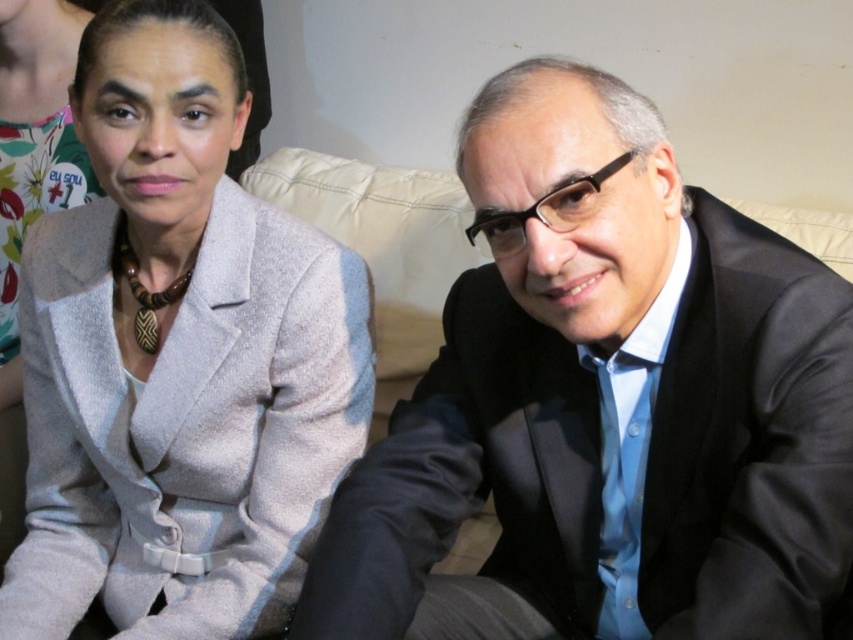
Does black glossy suit at right appear under matte gray blazer at center?

Indeed, black glossy suit at right is positioned under matte gray blazer at center.

Which of these two, black glossy suit at right or matte gray blazer at center, stands shorter?

Standing shorter between the two is black glossy suit at right.

You are a GUI agent. You are given a task and a screenshot of the screen. Output one action in this format:
    pyautogui.click(x=<x>, y=<y>)
    Task: Click on the black glossy suit at right
    
    Given the screenshot: What is the action you would take?
    pyautogui.click(x=605, y=404)

Is black glossy suit at right wider than matte gray blazer at upper left?

Correct, the width of black glossy suit at right exceeds that of matte gray blazer at upper left.

Is black glossy suit at right to the right of matte gray blazer at upper left from the viewer's perspective?

Indeed, black glossy suit at right is positioned on the right side of matte gray blazer at upper left.

Does point (700, 557) come in front of point (3, 13)?

Yes, point (700, 557) is in front of point (3, 13).

Locate an element on the screen. The width and height of the screenshot is (853, 640). black glossy suit at right is located at coordinates (605, 404).

Does matte gray blazer at center have a smaller size compared to matte gray blazer at upper left?

Incorrect, matte gray blazer at center is not smaller in size than matte gray blazer at upper left.

Is matte gray blazer at center thinner than matte gray blazer at upper left?

In fact, matte gray blazer at center might be wider than matte gray blazer at upper left.

Does point (204, 268) lie behind point (12, 106)?

That is False.

You are a GUI agent. You are given a task and a screenshot of the screen. Output one action in this format:
    pyautogui.click(x=<x>, y=<y>)
    Task: Click on the matte gray blazer at center
    
    Given the screenshot: What is the action you would take?
    pyautogui.click(x=178, y=356)